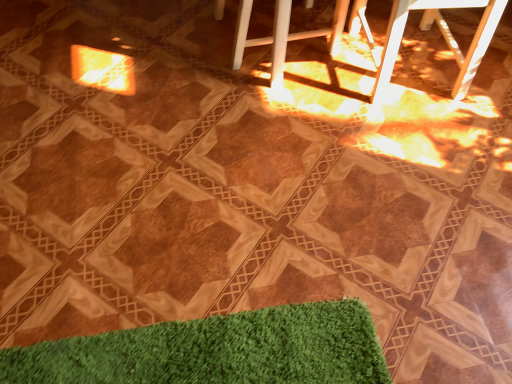
Question: Is white plastic bar stool at center, the first bar stool positioned from the left, in front of white plastic bar stool at upper right, placed as the second bar stool when sorted from left to right?

Choices:
 (A) yes
 (B) no

Answer: (B)

Question: Can we say white plastic bar stool at center, marked as the 2th bar stool in a right-to-left arrangement, lies outside white plastic bar stool at upper right, which is the first bar stool from right to left?

Choices:
 (A) yes
 (B) no

Answer: (A)

Question: From the image's perspective, is white plastic bar stool at center, marked as the 2th bar stool in a right-to-left arrangement, located beneath white plastic bar stool at upper right, which is the first bar stool from right to left?

Choices:
 (A) yes
 (B) no

Answer: (B)

Question: Can you confirm if white plastic bar stool at center, marked as the 2th bar stool in a right-to-left arrangement, is shorter than white plastic bar stool at upper right, placed as the second bar stool when sorted from left to right?

Choices:
 (A) yes
 (B) no

Answer: (A)

Question: Is white plastic bar stool at center, the first bar stool positioned from the left, wider than white plastic bar stool at upper right, placed as the second bar stool when sorted from left to right?

Choices:
 (A) yes
 (B) no

Answer: (A)

Question: Can you confirm if white plastic bar stool at center, the first bar stool positioned from the left, is smaller than white plastic bar stool at upper right, placed as the second bar stool when sorted from left to right?

Choices:
 (A) no
 (B) yes

Answer: (B)

Question: Could you tell me if white plastic bar stool at upper right, which is the first bar stool from right to left, is turned towards white plastic bar stool at center, marked as the 2th bar stool in a right-to-left arrangement?

Choices:
 (A) no
 (B) yes

Answer: (A)

Question: From a real-world perspective, does white plastic bar stool at upper right, which is the first bar stool from right to left, stand above white plastic bar stool at center, marked as the 2th bar stool in a right-to-left arrangement?

Choices:
 (A) no
 (B) yes

Answer: (B)

Question: Is white plastic bar stool at upper right, placed as the second bar stool when sorted from left to right, at the right side of white plastic bar stool at center, marked as the 2th bar stool in a right-to-left arrangement?

Choices:
 (A) yes
 (B) no

Answer: (A)

Question: Is white plastic bar stool at upper right, which is the first bar stool from right to left, further to the viewer compared to white plastic bar stool at center, marked as the 2th bar stool in a right-to-left arrangement?

Choices:
 (A) yes
 (B) no

Answer: (B)

Question: Is white plastic bar stool at upper right, which is the first bar stool from right to left, not close to white plastic bar stool at center, the first bar stool positioned from the left?

Choices:
 (A) yes
 (B) no

Answer: (B)

Question: Does white plastic bar stool at upper right, placed as the second bar stool when sorted from left to right, appear on the left side of white plastic bar stool at center, marked as the 2th bar stool in a right-to-left arrangement?

Choices:
 (A) no
 (B) yes

Answer: (A)

Question: Considering the positions of white plastic bar stool at center, the first bar stool positioned from the left, and white plastic bar stool at upper right, which is the first bar stool from right to left, in the image, is white plastic bar stool at center, the first bar stool positioned from the left, wider or thinner than white plastic bar stool at upper right, which is the first bar stool from right to left,?

Choices:
 (A) thin
 (B) wide

Answer: (B)